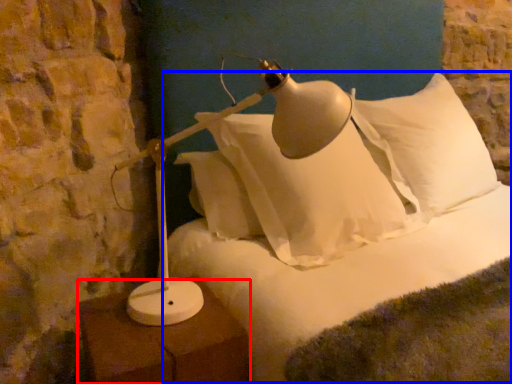
Question: Which point is closer to the camera, furniture (highlighted by a red box) or bed (highlighted by a blue box)?

Choices:
 (A) furniture
 (B) bed

Answer: (A)